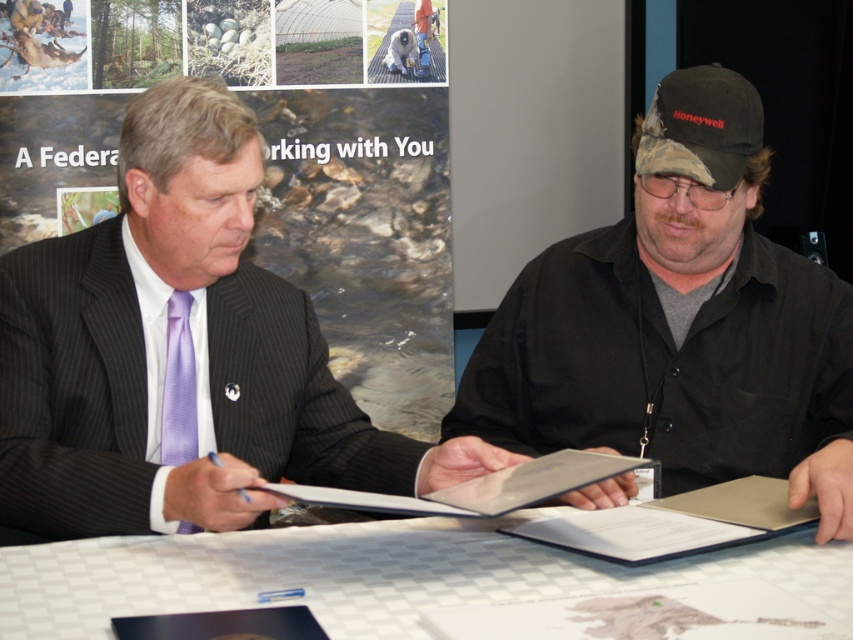
Can you confirm if matte black suit at left is positioned above white checkered table at center?

Correct, matte black suit at left is located above white checkered table at center.

Where is `matte black suit at left`? This screenshot has height=640, width=853. matte black suit at left is located at coordinates (73, 390).

At what (x,y) coordinates should I click in order to perform the action: click on matte black suit at left. Please return your answer as a coordinate pair (x, y). This screenshot has height=640, width=853. Looking at the image, I should click on (73, 390).

Which of these two, matte black suit at center or black fabric baseball cap at center, stands shorter?

Standing shorter between the two is black fabric baseball cap at center.

Identify the location of matte black suit at center. (178, 353).

The width and height of the screenshot is (853, 640). Describe the element at coordinates (178, 353) in the screenshot. I see `matte black suit at center` at that location.

I want to click on matte black suit at center, so click(178, 353).

Does point (569, 500) come behind point (830, 572)?

Yes, it is behind point (830, 572).

Which is above, matte black suit at center or white checkered table at center?

matte black suit at center is above.

Is point (238, 148) positioned in front of point (55, 548)?

No.

You are a GUI agent. You are given a task and a screenshot of the screen. Output one action in this format:
    pyautogui.click(x=<x>, y=<y>)
    Task: Click on the matte black suit at center
    
    Given the screenshot: What is the action you would take?
    pyautogui.click(x=178, y=353)